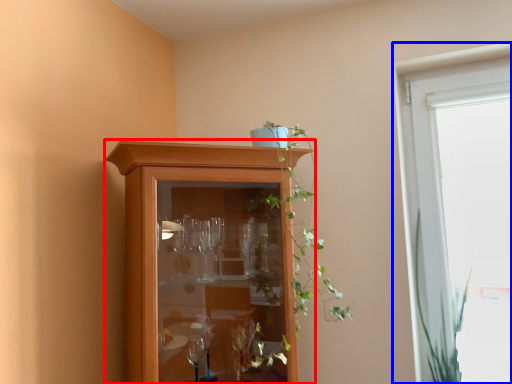
Question: Which object is closer to the camera taking this photo, cupboard (highlighted by a red box) or window (highlighted by a blue box)?

Choices:
 (A) cupboard
 (B) window

Answer: (A)